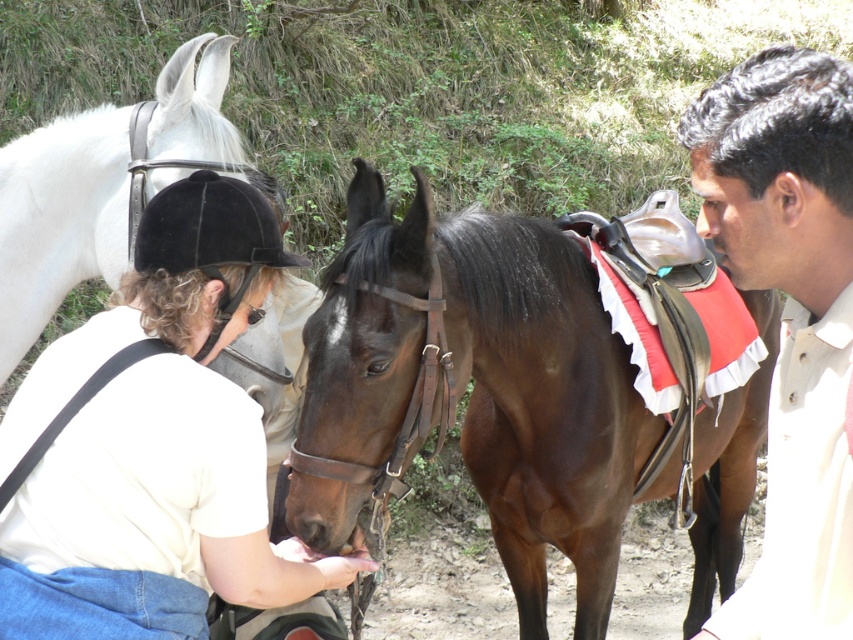
Can you confirm if smooth beige shirt at right is thinner than white leather bridle at upper left?

Indeed, smooth beige shirt at right has a lesser width compared to white leather bridle at upper left.

Does smooth beige shirt at right appear under white leather bridle at upper left?

Yes.

The image size is (853, 640). I want to click on smooth beige shirt at right, so click(x=788, y=317).

Find the location of a particular element. The width and height of the screenshot is (853, 640). white matte helmet at upper left is located at coordinates (161, 436).

Is point (160, 266) behind point (836, 630)?

Yes, point (160, 266) is behind point (836, 630).

At what (x,y) coordinates should I click in order to perform the action: click on white matte helmet at upper left. Please return your answer as a coordinate pair (x, y). The width and height of the screenshot is (853, 640). Looking at the image, I should click on (161, 436).

Does white matte helmet at upper left have a lesser width compared to white leather bridle at upper left?

Correct, white matte helmet at upper left's width is less than white leather bridle at upper left's.

This screenshot has width=853, height=640. I want to click on white matte helmet at upper left, so click(161, 436).